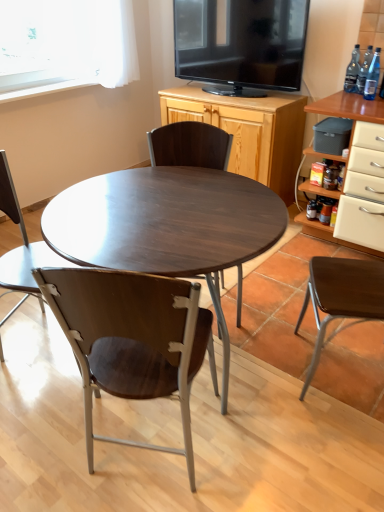
Describe the element at coordinates (132, 339) in the screenshot. I see `wooden chair at center, the 3th chair viewed from the right` at that location.

Image resolution: width=384 pixels, height=512 pixels. What do you see at coordinates (349, 108) in the screenshot?
I see `matte wood desk at right` at bounding box center [349, 108].

Describe the element at coordinates (167, 226) in the screenshot. Image resolution: width=384 pixels, height=512 pixels. I see `dark wood/finish coffee table at center` at that location.

Measure the distance between clear glass bottle at upper right, the 1th bottle from the back, and camera.

clear glass bottle at upper right, the 1th bottle from the back, is 8.82 feet from camera.

What are the coordinates of `wooden chair at center, the 3th chair viewed from the right` in the screenshot? It's located at (132, 339).

Is dark wood/finish coffee table at center beside wooden chair at lower left, acting as the fourth chair starting from the right?

No, dark wood/finish coffee table at center is not in contact with wooden chair at lower left, acting as the fourth chair starting from the right.

Considering the sizes of objects dark wood/finish coffee table at center and wooden chair at lower left, the first chair positioned from the left, in the image provided, who is wider, dark wood/finish coffee table at center or wooden chair at lower left, the first chair positioned from the left,?

dark wood/finish coffee table at center is wider.

This screenshot has width=384, height=512. What are the coordinates of `chair that is the 2nd object to the left of the dark wood/finish coffee table at center, starting at the anchor` in the screenshot? It's located at (21, 247).

Is wooden cabinet at upper center oriented towards clear glass bottle at upper right, the 1th bottle from the back?

No, wooden cabinet at upper center is not aimed at clear glass bottle at upper right, the 1th bottle from the back.

Is wooden cabinet at upper center located outside clear glass bottle at upper right, the 1th bottle from the back?

Yes.

Considering the sizes of wooden cabinet at upper center and clear glass bottle at upper right, the 1th bottle from the back, in the image, is wooden cabinet at upper center wider or thinner than clear glass bottle at upper right, the 1th bottle from the back,?

In the image, wooden cabinet at upper center appears to be wider than clear glass bottle at upper right, the 1th bottle from the back.

Would you say brown wood chair at right, arranged as the 1th chair when viewed from the right, contains matte black tv at upper center?

No, matte black tv at upper center is located outside of brown wood chair at right, arranged as the 1th chair when viewed from the right.

Is brown wood chair at right, acting as the fourth chair starting from the left, closer to camera compared to matte black tv at upper center?

Yes.

In the scene shown: Which object is wider, brown wood chair at right, acting as the fourth chair starting from the left, or matte black tv at upper center?

Wider between the two is brown wood chair at right, acting as the fourth chair starting from the left.

Looking at this image, from a real-world perspective, is brown wood chair at right, arranged as the 1th chair when viewed from the right, positioned over matte black tv at upper center based on gravity?

No, from a real-world perspective, brown wood chair at right, arranged as the 1th chair when viewed from the right, is not on top of matte black tv at upper center.

Which of these two, wooden chair at lower left, acting as the fourth chair starting from the right, or blue glass bottle at upper right, arranged as the first bottle when viewed from the front, stands shorter?

Standing shorter between the two is blue glass bottle at upper right, arranged as the first bottle when viewed from the front.

Considering the relative sizes of wooden chair at lower left, acting as the fourth chair starting from the right, and blue glass bottle at upper right, the 3th bottle positioned from the back, in the image provided, is wooden chair at lower left, acting as the fourth chair starting from the right, thinner than blue glass bottle at upper right, the 3th bottle positioned from the back,?

Incorrect, the width of wooden chair at lower left, acting as the fourth chair starting from the right, is not less than that of blue glass bottle at upper right, the 3th bottle positioned from the back.

Considering the relative sizes of wooden chair at lower left, acting as the fourth chair starting from the right, and blue glass bottle at upper right, arranged as the first bottle when viewed from the front, in the image provided, is wooden chair at lower left, acting as the fourth chair starting from the right, smaller than blue glass bottle at upper right, arranged as the first bottle when viewed from the front,?

Actually, wooden chair at lower left, acting as the fourth chair starting from the right, might be larger than blue glass bottle at upper right, arranged as the first bottle when viewed from the front.

Is wooden chair at lower left, the first chair positioned from the left, aimed at blue glass bottle at upper right, arranged as the first bottle when viewed from the front?

No, wooden chair at lower left, the first chair positioned from the left, is not turned towards blue glass bottle at upper right, arranged as the first bottle when viewed from the front.

From a real-world perspective, is blue glass bottle at upper right, arranged as the first bottle when viewed from the front, above or below wooden chair at lower left, acting as the fourth chair starting from the right?

In terms of real-world spatial position, blue glass bottle at upper right, arranged as the first bottle when viewed from the front, is above wooden chair at lower left, acting as the fourth chair starting from the right.

Does blue glass bottle at upper right, the 3th bottle positioned from the back, lie behind wooden chair at lower left, acting as the fourth chair starting from the right?

That is True.

Is blue glass bottle at upper right, the 3th bottle positioned from the back, touching wooden chair at lower left, acting as the fourth chair starting from the right?

blue glass bottle at upper right, the 3th bottle positioned from the back, and wooden chair at lower left, acting as the fourth chair starting from the right, are clearly separated.

Does blue glass bottle at upper right, the 3th bottle positioned from the back, appear on the right side of wooden chair at lower left, the first chair positioned from the left?

Yes.

What are the coordinates of `the 2nd bottle below the matte black tv at upper center (from a real-world perspective)` in the screenshot? It's located at (x=352, y=71).

Looking at this image, can you see clear glass bottle at upper right, marked as the 3th bottle in a front-to-back arrangement, touching matte black tv at upper center?

clear glass bottle at upper right, marked as the 3th bottle in a front-to-back arrangement, and matte black tv at upper center are not in contact.

Is clear glass bottle at upper right, the 1th bottle from the back, bigger than matte black tv at upper center?

Incorrect, clear glass bottle at upper right, the 1th bottle from the back, is not larger than matte black tv at upper center.

Could you tell me if clear glass bottle at upper right, marked as the 3th bottle in a front-to-back arrangement, is turned towards matte black tv at upper center?

No, clear glass bottle at upper right, marked as the 3th bottle in a front-to-back arrangement, is not facing towards matte black tv at upper center.

I want to click on chair above the wooden chair at lower left, the first chair positioned from the left (from the image's perspective), so click(x=190, y=145).

Could you measure the distance between dark wood chair at center, positioned as the 3th chair in left-to-right order, and wooden chair at lower left, the first chair positioned from the left?

A distance of 31.00 inches exists between dark wood chair at center, positioned as the 3th chair in left-to-right order, and wooden chair at lower left, the first chair positioned from the left.

Which object is positioned more to the right, dark wood chair at center, acting as the 2th chair starting from the right, or wooden chair at lower left, acting as the fourth chair starting from the right?

dark wood chair at center, acting as the 2th chair starting from the right.

Which is nearer, (173, 164) or (54, 256)?

The point (54, 256) is in front.

This screenshot has height=512, width=384. Find the location of `chair that is the 2nd one when counting backward from the dark wood/finish coffee table at center`. chair that is the 2nd one when counting backward from the dark wood/finish coffee table at center is located at coordinates (21, 247).

Which bottle is the 1st one when counting from the right side of the wooden cabinet at upper center? Please provide its 2D coordinates.

[(352, 71)]

When comparing their distances from wooden chair at lower left, the first chair positioned from the left, does wooden cabinet at upper center or dark wood/finish coffee table at center seem further?

wooden cabinet at upper center is positioned further to the anchor wooden chair at lower left, the first chair positioned from the left.

Considering their positions, is matte black tv at upper center positioned further to brown wood chair at right, arranged as the 1th chair when viewed from the right, than wooden chair at center, positioned as the 2th chair in left-to-right order?

The object further to brown wood chair at right, arranged as the 1th chair when viewed from the right, is matte black tv at upper center.

Which object lies further to the anchor point clear glass bottle at upper right, marked as the 3th bottle in a front-to-back arrangement, matte wood desk at right or blue glass bottle at upper right, the 3th bottle positioned from the back?

The object further to clear glass bottle at upper right, marked as the 3th bottle in a front-to-back arrangement, is matte wood desk at right.

When comparing their distances from blue glass bottle at upper right, arranged as the first bottle when viewed from the front, does matte black tv at upper center or brown wood chair at right, arranged as the 1th chair when viewed from the right, seem further?

brown wood chair at right, arranged as the 1th chair when viewed from the right, lies further to blue glass bottle at upper right, arranged as the first bottle when viewed from the front, than the other object.

Which object lies nearer to the anchor point dark wood/finish coffee table at center, dark wood chair at center, acting as the 2th chair starting from the right, or blue glass bottle at upper right, the 3th bottle positioned from the back?

dark wood chair at center, acting as the 2th chair starting from the right, lies closer to dark wood/finish coffee table at center than the other object.

Based on their spatial positions, is wooden chair at center, the 3th chair viewed from the right, or wooden chair at lower left, the first chair positioned from the left, closer to dark wood chair at center, positioned as the 3th chair in left-to-right order?

The object closer to dark wood chair at center, positioned as the 3th chair in left-to-right order, is wooden chair at lower left, the first chair positioned from the left.

Based on their spatial positions, is matte wood desk at right or dark wood chair at center, acting as the 2th chair starting from the right, closer to wooden chair at center, the 3th chair viewed from the right?

dark wood chair at center, acting as the 2th chair starting from the right, lies closer to wooden chair at center, the 3th chair viewed from the right, than the other object.

Based on their spatial positions, is matte black tv at upper center or transparent glass bottle at upper right, placed as the second bottle when sorted from back to front, further from wooden cabinet at upper center?

transparent glass bottle at upper right, placed as the second bottle when sorted from back to front, lies further to wooden cabinet at upper center than the other object.

Find the location of a particular element. Image resolution: width=384 pixels, height=512 pixels. coffee table between wooden chair at lower left, acting as the fourth chair starting from the right, and matte wood desk at right from left to right is located at coordinates (x=167, y=226).

Identify the location of cabinetry situated between wooden chair at lower left, the first chair positioned from the left, and matte wood desk at right from left to right. (248, 130).

Locate an element on the screen. This screenshot has height=512, width=384. coffee table between wooden chair at center, positioned as the 2th chair in left-to-right order, and clear glass bottle at upper right, the 1th bottle from the back, along the z-axis is located at coordinates (167, 226).

You are a GUI agent. You are given a task and a screenshot of the screen. Output one action in this format:
    pyautogui.click(x=<x>, y=<y>)
    Task: Click on the cabinetry between matte black tv at upper center and dark wood chair at center, positioned as the 3th chair in left-to-right order, in the up-down direction
    
    Given the screenshot: What is the action you would take?
    pyautogui.click(x=248, y=130)